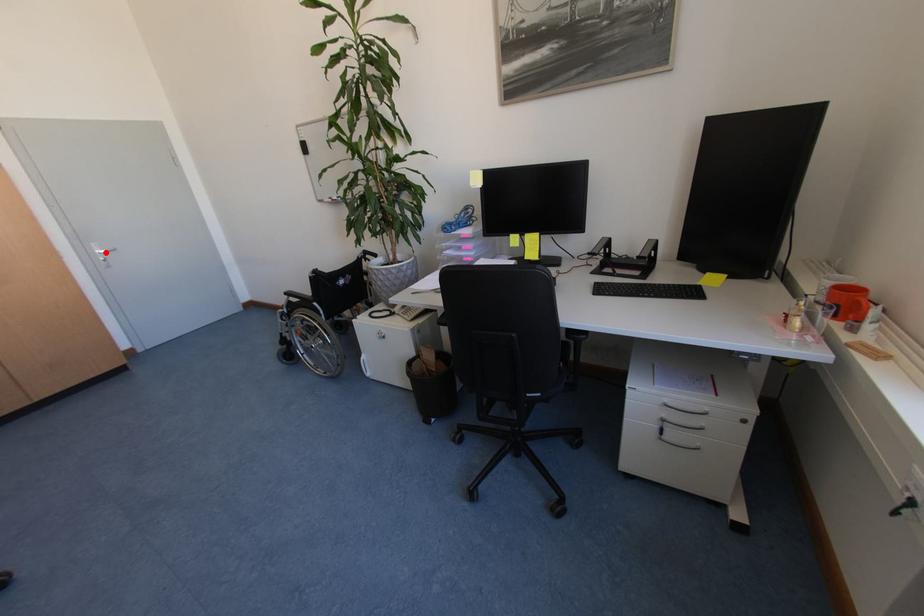
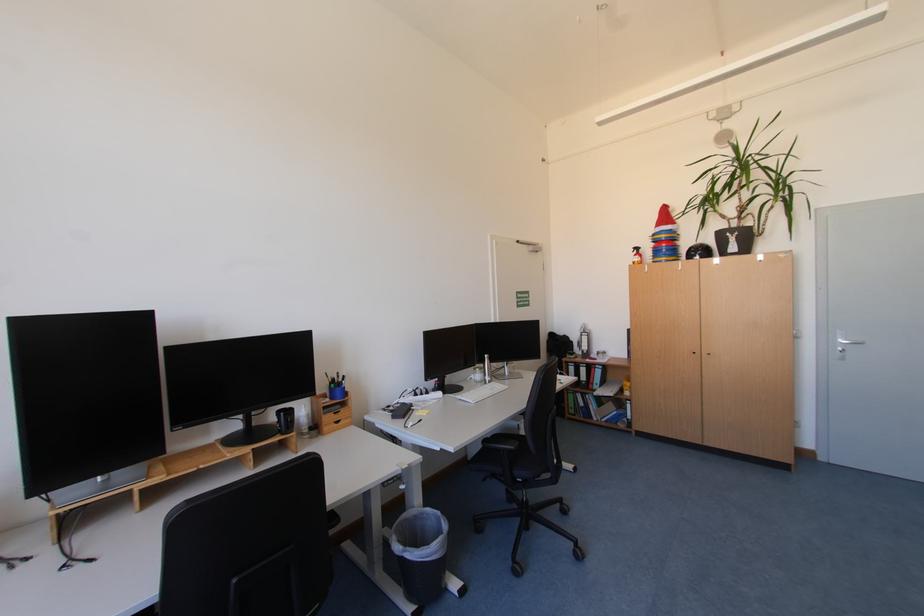
Find the pixel in the second image that matches the highlighted location in the first image.

(848, 341)